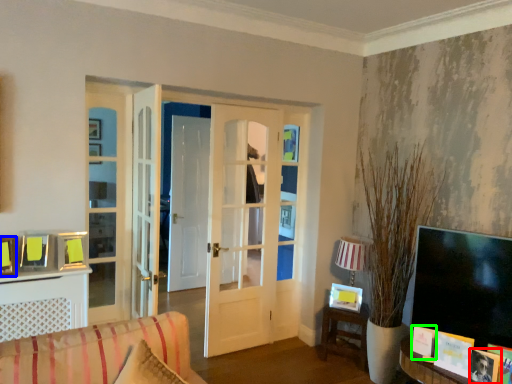
Question: Which is farther away from picture frame (highlighted by a red box)? picture frame (highlighted by a blue box) or picture frame (highlighted by a green box)?

Choices:
 (A) picture frame
 (B) picture frame

Answer: (A)